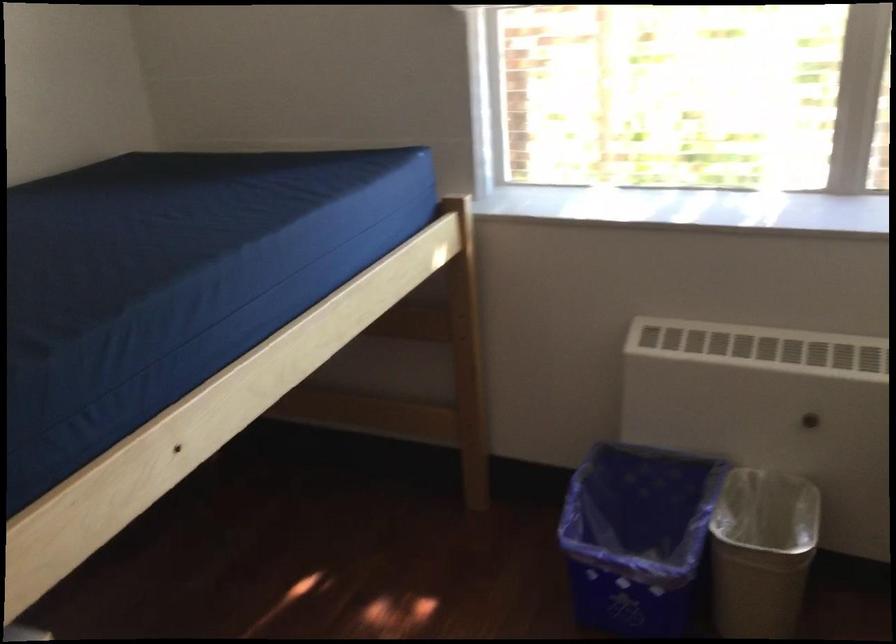
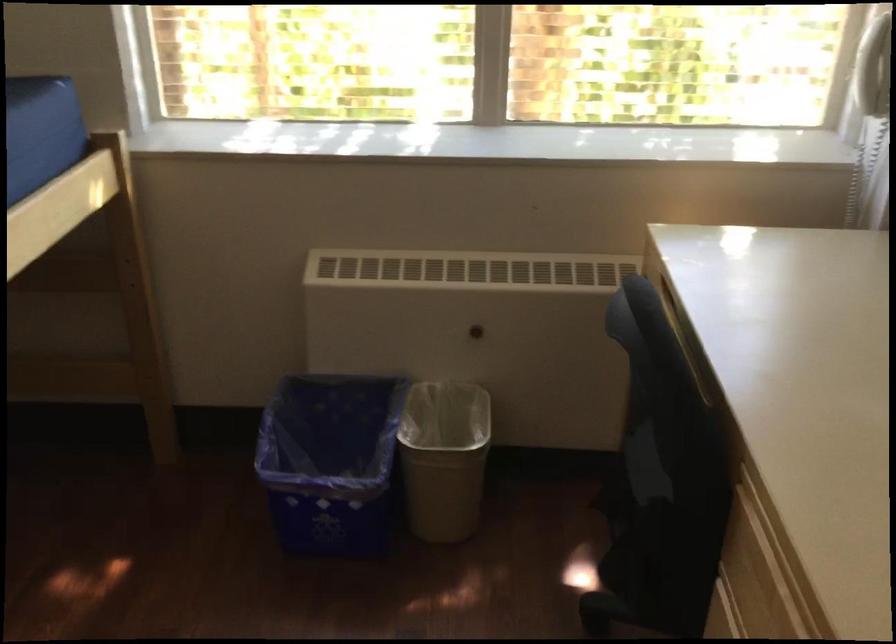
Find the pixel in the second image that matches point (810, 419) in the first image.

(476, 330)